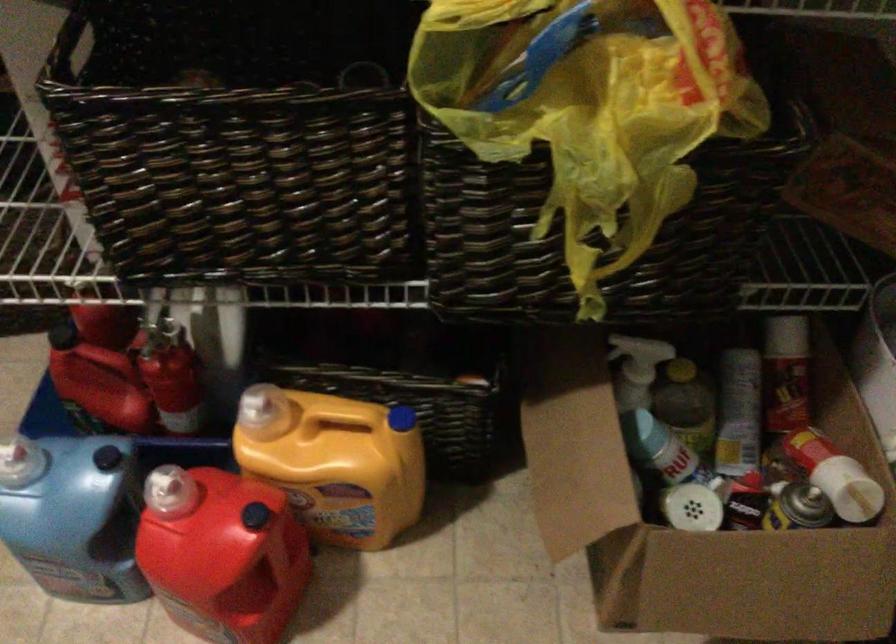
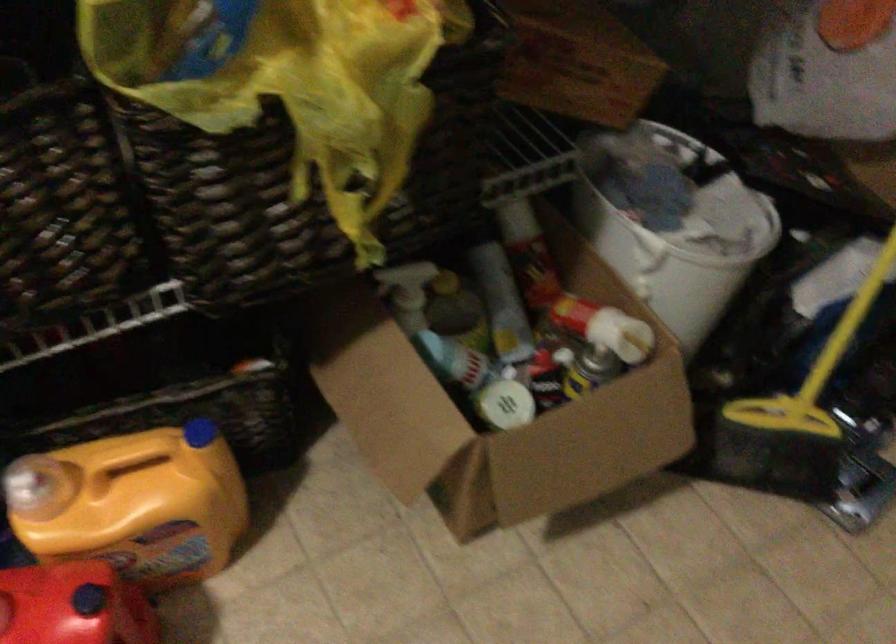
Where in the second image is the point corresponding to point (325, 455) from the first image?

(133, 504)